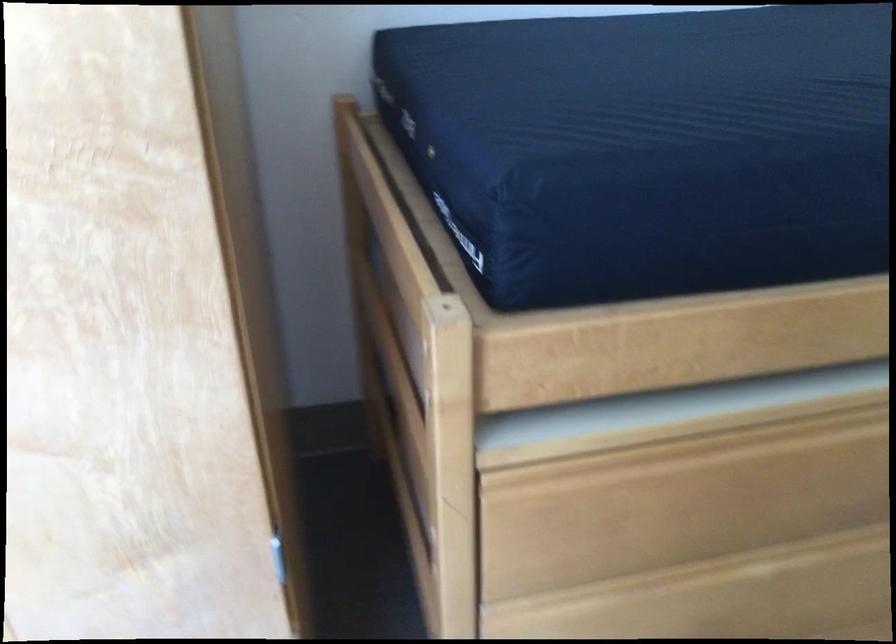
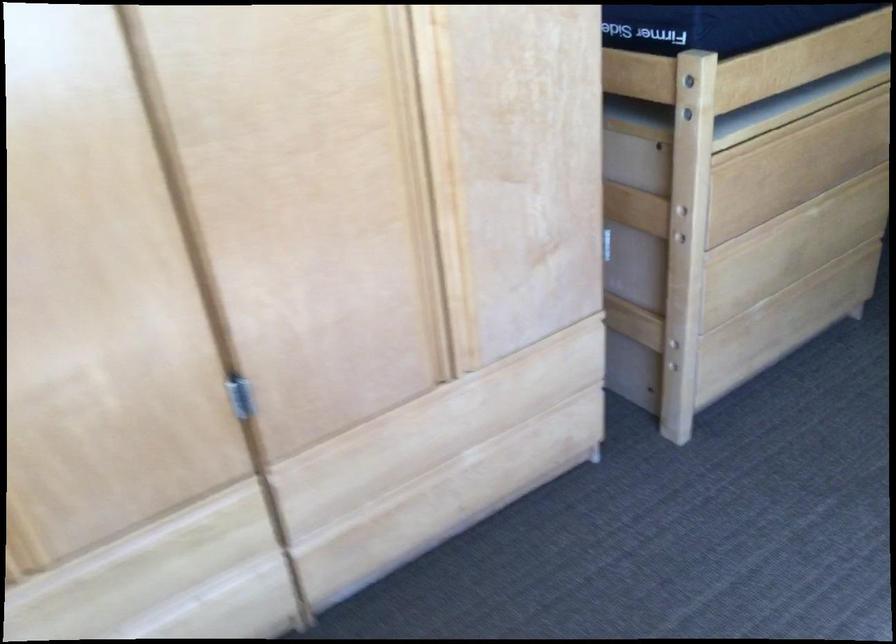
Locate, in the second image, the point that corresponds to point 639,526 in the first image.

(767, 185)